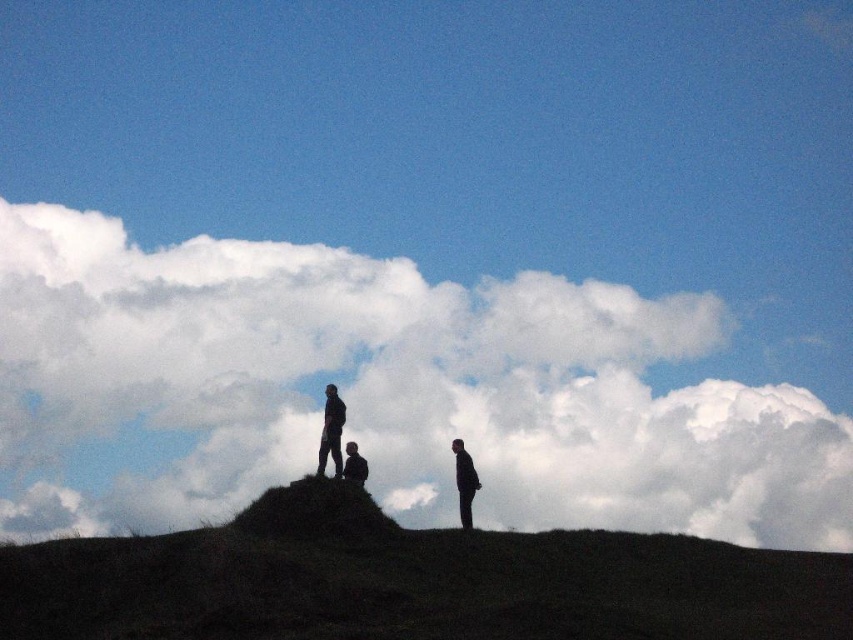
You are a photographer planning to take a sunset photo of the matte black figure at center and the dark brown earth at center. Since the sun is low, which object will receive more sunlight and appear brighter in the photo?

The matte black figure at center will appear brighter in the photo because it is positioned above the dark brown earth at center, which is in shadow.

You are planning to set up a picnic blanket on the dark grassy hillside at center. You also have a portable speaker that needs to be placed exactly 7 meters away from the picnic blanket. Can you place the speaker near the matte black figure at center?

The dark grassy hillside at center and matte black figure at center are 7.28 meters apart from each other. Since 7.28 meters is slightly more than 7 meters, placing the speaker near the matte black figure at center would satisfy the requirement of being approximately 7 meters away from the picnic blanket on the dark grassy hillside at center.